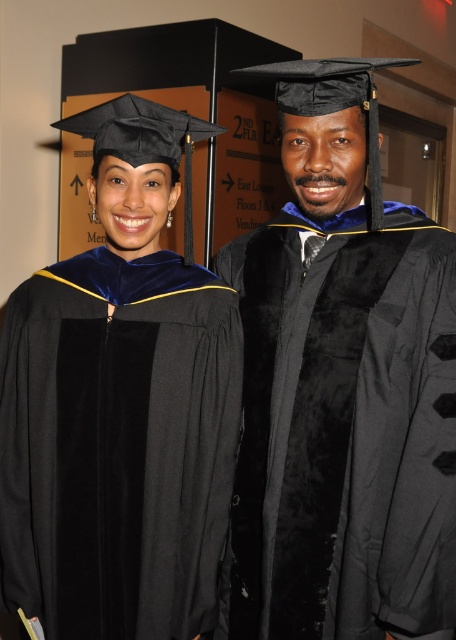
Looking at this image, you are a photographer at a graduation ceremony. You need to position the two graduates so that their gowns are clearly visible. Which gown should be moved forward to ensure the black matte graduation gown at center is in front of the velvet black gown at center?

The velvet black gown at center should be moved backward so that the black matte graduation gown at center remains in front of it.